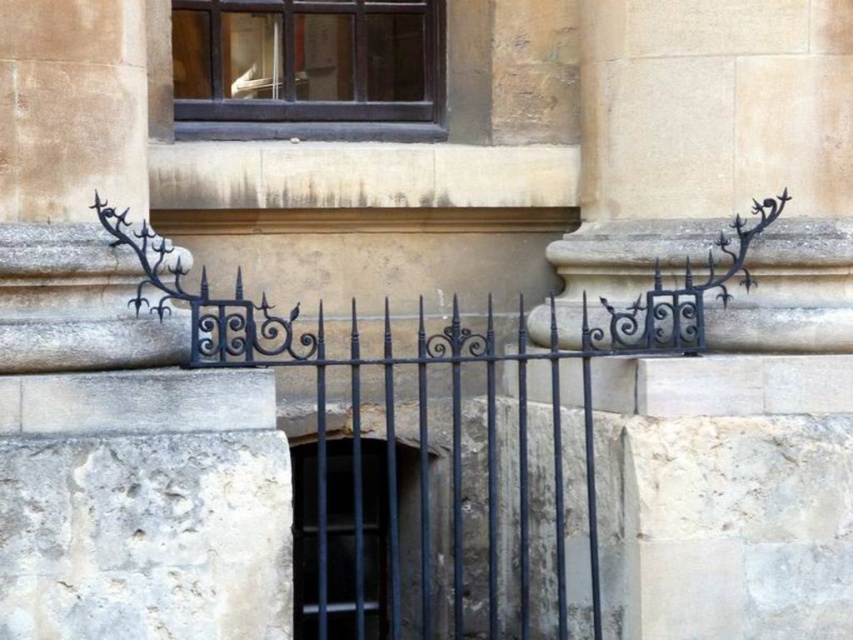
In the scene shown: You are standing in front of the building and want to locate the dark brown wood window at upper center. What are the coordinates where you should look?

The dark brown wood window at upper center is located at coordinates point (308, 68).

You are an architect assessing the building facade. You need to determine if the dark brown wood window at upper center can fit through an opening created by removing a section of the black metal bars at center. Based on their sizes, is this feasible?

The dark brown wood window at upper center has a smaller size compared to the black metal bars at center, so it is feasible to fit the window through the opening created by removing a section of the black metal bars at center.

You are standing in front of the building and notice two points marked on the facade. The first point is at coordinates point (244, 112) and the second is at point (296, 492). Which of these points appears closer to you?

Point (244, 112) is closer to the camera than point (296, 492), so the first point appears closer to you.